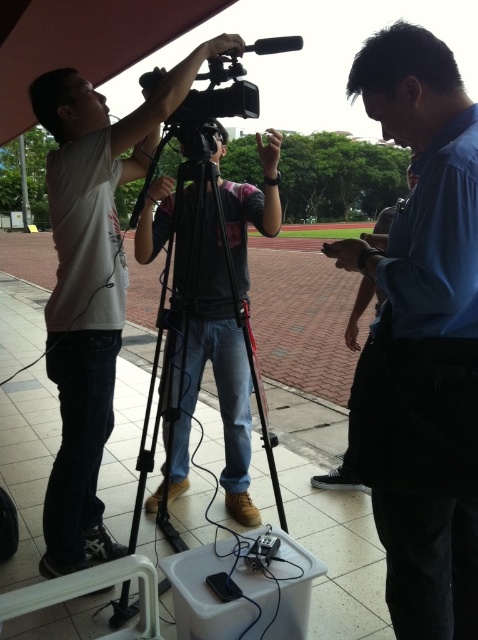
In the scene shown: You are standing at the point labeled point (384, 381) and want to walk to the point labeled point (178, 64). Which direction should you move in relation to the camera operator?

Since point (384, 381) is closer to the viewer than point (178, 64), you should move away from the camera operator to reach the point labeled point (178, 64).

You are standing at the point labeled point (117, 547) and want to walk to point (161, 227). Which direction should you move in to get there?

You should move towards the lower left direction to reach point (161, 227) from point (117, 547).

Based on the photo, you are a photographer trying to capture a photo of the matte white shirt at upper left and the black matte tripod at center in the scene. Based on their positions, which object should you focus on first if you want to include both in your frame without moving the camera?

The matte white shirt at upper left is located above the black matte tripod at center, so you should focus on the matte white shirt at upper left first to ensure both are within the frame.